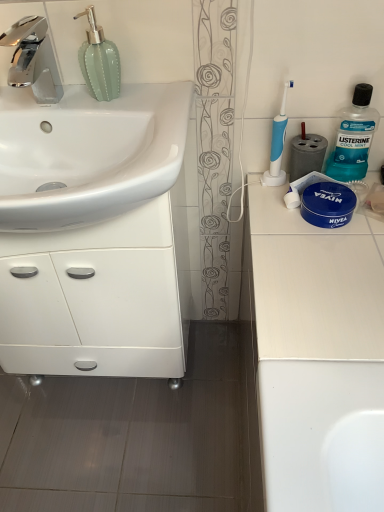
Identify the location of free space in front of green glass soap dispenser at upper left. This screenshot has width=384, height=512. (117, 120).